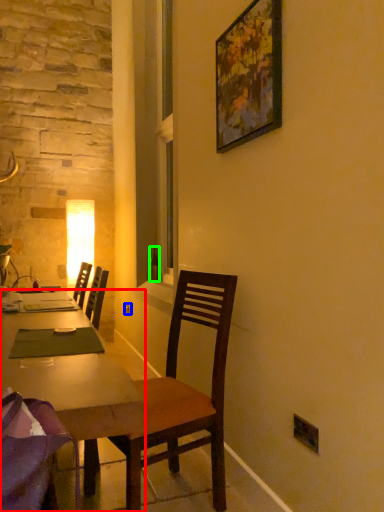
Question: Considering the real-world distances, which object is farthest from desk (highlighted by a red box)? power outlet (highlighted by a blue box) or bottle (highlighted by a green box)?

Choices:
 (A) power outlet
 (B) bottle

Answer: (A)